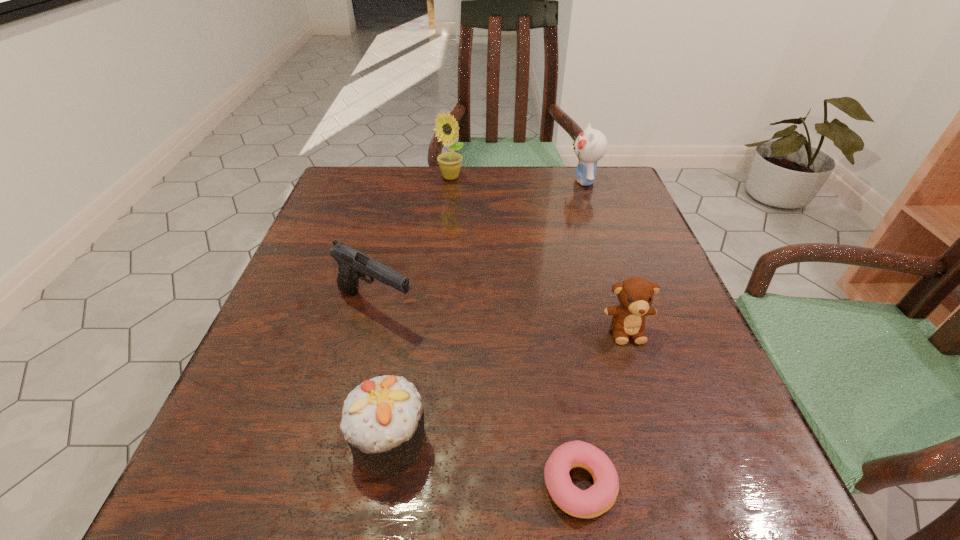
Find the location of `free space that is in between the gun and the fifth shortest object`. free space that is in between the gun and the fifth shortest object is located at coordinates (479, 244).

I want to click on free space that is in between the teddy bear and the sunflower, so click(539, 254).

Identify the location of vacant area that lies between the tallest object and the cupcake. This screenshot has width=960, height=540. (420, 309).

This screenshot has height=540, width=960. Identify the location of vacant space that is in between the cupcake and the tallest object. (420, 309).

The width and height of the screenshot is (960, 540). In order to click on vacant space that is in between the sunflower and the second tallest object in this screenshot , I will do `click(517, 179)`.

Find the location of `free space between the second tallest object and the sunflower`. free space between the second tallest object and the sunflower is located at coordinates (517, 179).

The image size is (960, 540). I want to click on free space between the cupcake and the sunflower, so click(420, 309).

Image resolution: width=960 pixels, height=540 pixels. I want to click on vacant space that is in between the cupcake and the tallest object, so click(x=420, y=309).

Identify the location of empty location between the cupcake and the gun. The height and width of the screenshot is (540, 960). (382, 374).

Identify the location of free space between the kitten and the cupcake. (487, 311).